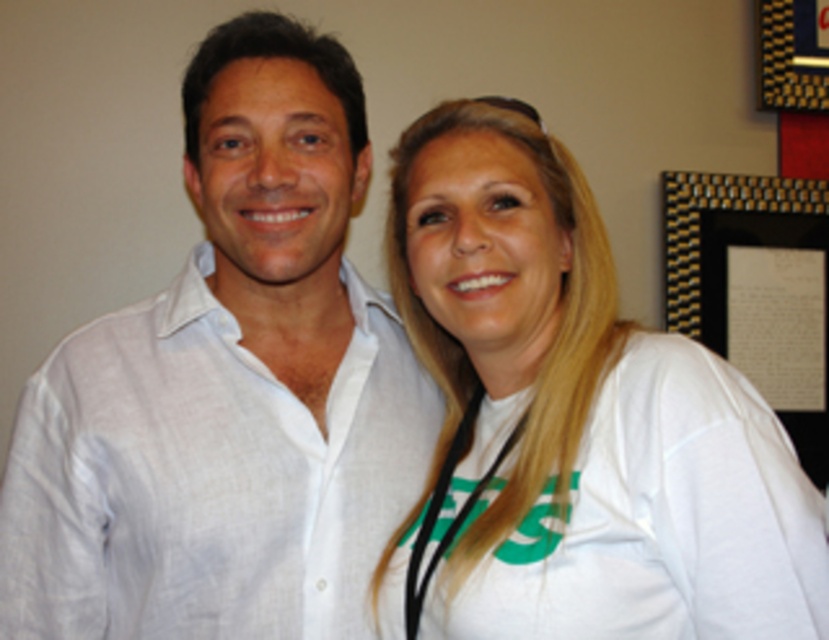
You are taking a photo of two people standing at point (505, 413) and point (369, 468). Which person is closer to the camera?

The person at point (505, 413) is closer to the camera than the person at point (369, 468).

From the picture: You are a photographer adjusting the camera settings to ensure both the white linen shirt at center and the black glossy picture frame at upper right are in focus. Which object should you adjust the focus for first if you want to prioritize the one closer to the camera?

The white linen shirt at center should be focused on first because it has a lesser height compared to the black glossy picture frame at upper right, indicating it is closer to the camera.